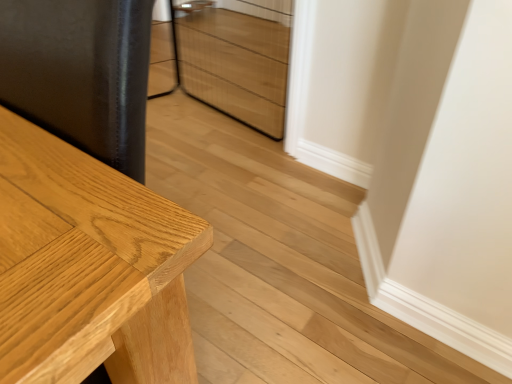
Locate an element on the screen. The height and width of the screenshot is (384, 512). free space on the front side of wooden drawer at center is located at coordinates (231, 160).